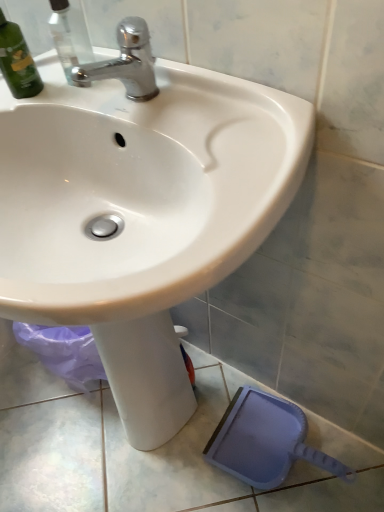
Question: Is green matte bottle at upper left behind chrome metallic faucet at upper center?

Choices:
 (A) no
 (B) yes

Answer: (B)

Question: From a real-world perspective, is green matte bottle at upper left positioned under chrome metallic faucet at upper center based on gravity?

Choices:
 (A) no
 (B) yes

Answer: (A)

Question: Is green matte bottle at upper left oriented away from chrome metallic faucet at upper center?

Choices:
 (A) yes
 (B) no

Answer: (B)

Question: Is green matte bottle at upper left smaller than chrome metallic faucet at upper center?

Choices:
 (A) yes
 (B) no

Answer: (B)

Question: Is green matte bottle at upper left not close to chrome metallic faucet at upper center?

Choices:
 (A) no
 (B) yes

Answer: (A)

Question: Relative to green matte bottle at upper left, is chrome metallic faucet at upper center in front or behind?

Choices:
 (A) behind
 (B) front

Answer: (B)

Question: Is point (129, 94) closer or farther from the camera than point (18, 31)?

Choices:
 (A) closer
 (B) farther

Answer: (A)

Question: From the image's perspective, is chrome metallic faucet at upper center above or below green matte bottle at upper left?

Choices:
 (A) below
 (B) above

Answer: (A)

Question: From a real-world perspective, is chrome metallic faucet at upper center above or below green matte bottle at upper left?

Choices:
 (A) above
 (B) below

Answer: (B)

Question: Is point (135, 76) closer or farther from the camera than point (175, 115)?

Choices:
 (A) closer
 (B) farther

Answer: (B)

Question: In the image, is chrome metallic faucet at upper center positioned in front of or behind white glossy sink at upper center?

Choices:
 (A) front
 (B) behind

Answer: (B)

Question: From a real-world perspective, is chrome metallic faucet at upper center above or below white glossy sink at upper center?

Choices:
 (A) below
 (B) above

Answer: (B)

Question: Considering the positions of chrome metallic faucet at upper center and white glossy sink at upper center in the image, is chrome metallic faucet at upper center wider or thinner than white glossy sink at upper center?

Choices:
 (A) thin
 (B) wide

Answer: (A)

Question: Is white glossy sink at upper center to the left or to the right of green matte bottle at upper left in the image?

Choices:
 (A) left
 (B) right

Answer: (B)

Question: Is white glossy sink at upper center inside the boundaries of green matte bottle at upper left, or outside?

Choices:
 (A) inside
 (B) outside

Answer: (B)